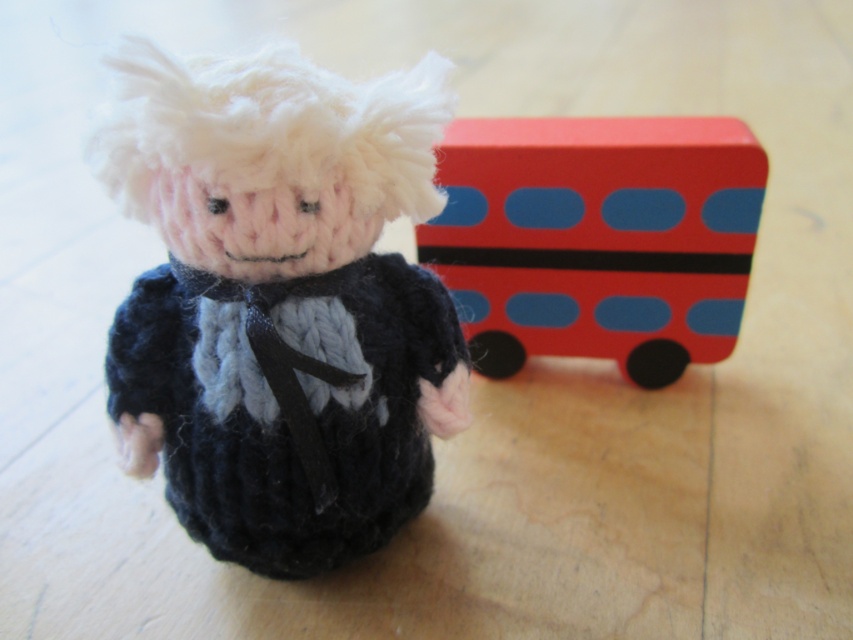
Question: Is knitted wool doll at center closer to the viewer compared to smooth plastic bus at right?

Choices:
 (A) no
 (B) yes

Answer: (B)

Question: Among these objects, which one is nearest to the camera?

Choices:
 (A) knitted wool doll at center
 (B) smooth plastic bus at right

Answer: (A)

Question: Does knitted wool doll at center lie in front of smooth plastic bus at right?

Choices:
 (A) no
 (B) yes

Answer: (B)

Question: Can you confirm if knitted wool doll at center is wider than smooth plastic bus at right?

Choices:
 (A) no
 (B) yes

Answer: (A)

Question: Which object is farther from the camera taking this photo?

Choices:
 (A) smooth plastic bus at right
 (B) knitted wool doll at center

Answer: (A)